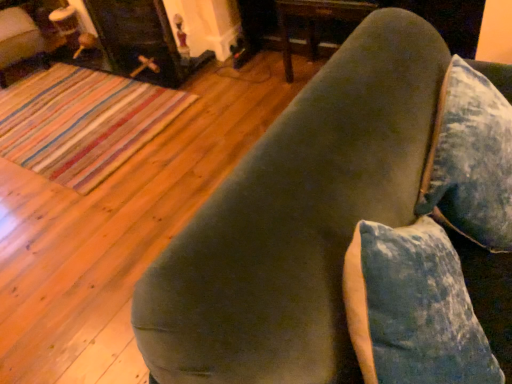
Locate an element on the screen. The height and width of the screenshot is (384, 512). velvet green couch at upper right is located at coordinates (344, 230).

What do you see at coordinates (344, 230) in the screenshot?
I see `velvet green couch at upper right` at bounding box center [344, 230].

What is the approximate width of matte black fireplace at upper left?

It is 11.18 inches.

The width and height of the screenshot is (512, 384). What do you see at coordinates (137, 39) in the screenshot?
I see `matte black fireplace at upper left` at bounding box center [137, 39].

Locate an element on the screen. matte black fireplace at upper left is located at coordinates pyautogui.click(x=137, y=39).

The width and height of the screenshot is (512, 384). I want to click on velvet green couch at upper right, so [x=344, y=230].

Is matte black fireplace at upper left at the right side of velvet green couch at upper right?

No.

Is the position of matte black fireplace at upper left less distant than that of velvet green couch at upper right?

No, the depth of matte black fireplace at upper left is greater than that of velvet green couch at upper right.

Which is nearer, (x=127, y=60) or (x=301, y=107)?

The point (x=301, y=107) is closer.

From the image's perspective, is matte black fireplace at upper left located beneath velvet green couch at upper right?

No, from the image's perspective, matte black fireplace at upper left is not beneath velvet green couch at upper right.

From a real-world perspective, does matte black fireplace at upper left sit lower than velvet green couch at upper right?

Yes.

Between matte black fireplace at upper left and velvet green couch at upper right, which one has smaller width?

With smaller width is matte black fireplace at upper left.

Between matte black fireplace at upper left and velvet green couch at upper right, which one has more height?

Standing taller between the two is matte black fireplace at upper left.

Looking at the image, does matte black fireplace at upper left seem bigger or smaller compared to velvet green couch at upper right?

In the image, matte black fireplace at upper left appears to be larger than velvet green couch at upper right.

Which is correct: matte black fireplace at upper left is inside velvet green couch at upper right, or outside of it?

matte black fireplace at upper left cannot be found inside velvet green couch at upper right.

Is matte black fireplace at upper left next to velvet green couch at upper right?

No, matte black fireplace at upper left is not beside velvet green couch at upper right.

Is velvet green couch at upper right at the back of matte black fireplace at upper left?

matte black fireplace at upper left is not turned away from velvet green couch at upper right.

How far apart are matte black fireplace at upper left and velvet green couch at upper right?

matte black fireplace at upper left is 2.14 meters away from velvet green couch at upper right.

This screenshot has width=512, height=384. Identify the location of furniture to the right of matte black fireplace at upper left. (344, 230).

Is velvet green couch at upper right to the right of matte black fireplace at upper left from the viewer's perspective?

Yes, velvet green couch at upper right is to the right of matte black fireplace at upper left.

Does velvet green couch at upper right come behind matte black fireplace at upper left?

No, velvet green couch at upper right is closer to the camera.

Is point (483, 189) closer or farther from the camera than point (149, 4)?

Point (483, 189) appears to be closer to the viewer than point (149, 4).

From the image's perspective, between velvet green couch at upper right and matte black fireplace at upper left, who is located below?

velvet green couch at upper right, from the image's perspective.

From a real-world perspective, is velvet green couch at upper right beneath matte black fireplace at upper left?

No, from a real-world perspective, velvet green couch at upper right is not beneath matte black fireplace at upper left.

Consider the image. Can you confirm if velvet green couch at upper right is wider than matte black fireplace at upper left?

Yes.

From their relative heights in the image, would you say velvet green couch at upper right is taller or shorter than matte black fireplace at upper left?

Considering their sizes, velvet green couch at upper right has less height than matte black fireplace at upper left.

Can you confirm if velvet green couch at upper right is bigger than matte black fireplace at upper left?

Actually, velvet green couch at upper right might be smaller than matte black fireplace at upper left.

Is velvet green couch at upper right positioned beyond the bounds of matte black fireplace at upper left?

Yes.

Can you see velvet green couch at upper right touching matte black fireplace at upper left?

No, velvet green couch at upper right is not making contact with matte black fireplace at upper left.

Does velvet green couch at upper right turn towards matte black fireplace at upper left?

No.

What's the angular difference between velvet green couch at upper right and matte black fireplace at upper left's facing directions?

90.2 degrees.

In order to click on fireplace located underneath the velvet green couch at upper right (from a real-world perspective) in this screenshot , I will do `click(137, 39)`.

You are a GUI agent. You are given a task and a screenshot of the screen. Output one action in this format:
    pyautogui.click(x=<x>, y=<y>)
    Task: Click on the furniture above the matte black fireplace at upper left (from a real-world perspective)
    This screenshot has width=512, height=384.
    Given the screenshot: What is the action you would take?
    pyautogui.click(x=344, y=230)

This screenshot has width=512, height=384. Find the location of `fireplace on the left side of velvet green couch at upper right`. fireplace on the left side of velvet green couch at upper right is located at coordinates (137, 39).